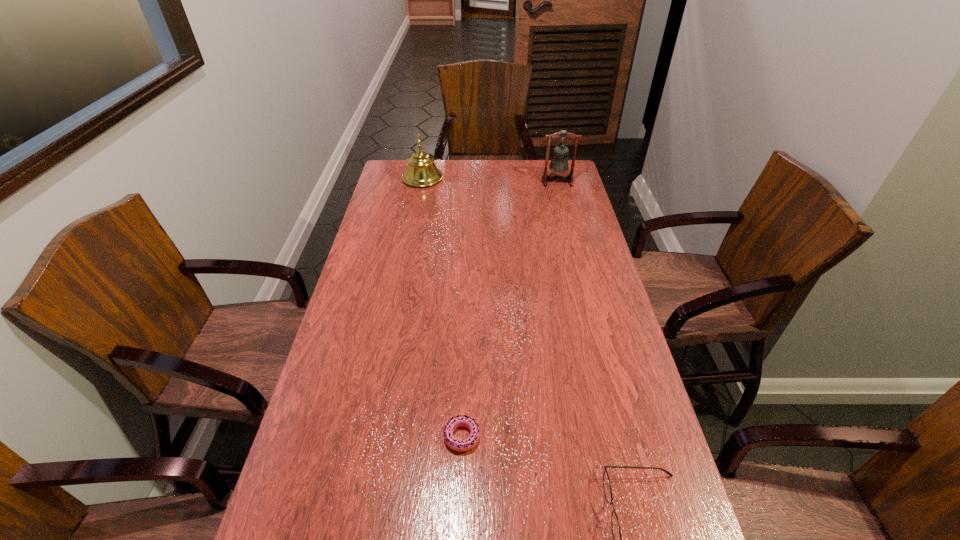
Locate an element on the screen. The height and width of the screenshot is (540, 960). vacant position in the image that satisfies the following two spatial constraints: 1. on the front side of the leftmost object; 2. on the left side of the right bell is located at coordinates (422, 181).

The image size is (960, 540). In order to click on vacant space that satisfies the following two spatial constraints: 1. on the front side of the third object from right to left; 2. on the right side of the left bell in this screenshot , I will do `click(372, 436)`.